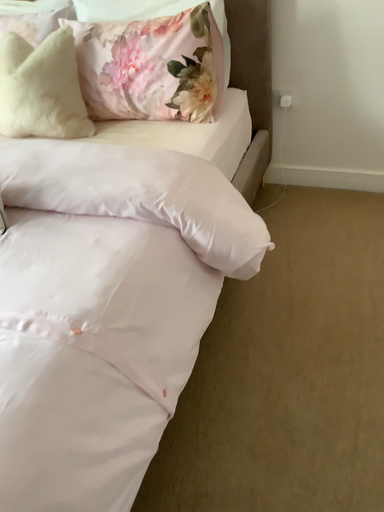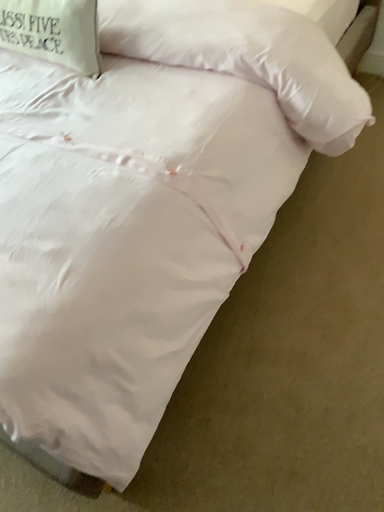
Question: How did the camera likely rotate when shooting the video?

Choices:
 (A) rotated right
 (B) rotated left

Answer: (B)